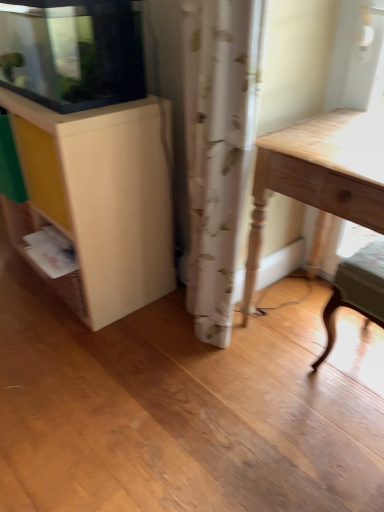
Question: Is matte white cabinet at upper left, which is the second cabinetry from bottom to top, inside matte white cabinet at left, which ranks as the first cabinetry in bottom-to-top order?

Choices:
 (A) yes
 (B) no

Answer: (B)

Question: From the image's perspective, would you say matte white cabinet at left, which appears as the 2th cabinetry when viewed from the top, is shown under matte white cabinet at upper left, which is the second cabinetry from bottom to top?

Choices:
 (A) yes
 (B) no

Answer: (A)

Question: Is matte white cabinet at left, which ranks as the first cabinetry in bottom-to-top order, at the right side of matte white cabinet at upper left, which is the second cabinetry from bottom to top?

Choices:
 (A) yes
 (B) no

Answer: (B)

Question: Is matte white cabinet at left, which ranks as the first cabinetry in bottom-to-top order, to the left of matte white cabinet at upper left, which is the second cabinetry from bottom to top, from the viewer's perspective?

Choices:
 (A) yes
 (B) no

Answer: (A)

Question: Does matte white cabinet at left, which ranks as the first cabinetry in bottom-to-top order, have a smaller size compared to matte white cabinet at upper left, placed as the 1th cabinetry when sorted from top to bottom?

Choices:
 (A) no
 (B) yes

Answer: (A)

Question: Could you tell me if matte white cabinet at left, which ranks as the first cabinetry in bottom-to-top order, is facing matte white cabinet at upper left, placed as the 1th cabinetry when sorted from top to bottom?

Choices:
 (A) yes
 (B) no

Answer: (B)

Question: Considering the relative positions of wooden chair at lower right and matte white cabinet at left, which appears as the 2th cabinetry when viewed from the top, in the image provided, is wooden chair at lower right to the right of matte white cabinet at left, which appears as the 2th cabinetry when viewed from the top, from the viewer's perspective?

Choices:
 (A) no
 (B) yes

Answer: (B)

Question: Is wooden chair at lower right far away from matte white cabinet at left, which appears as the 2th cabinetry when viewed from the top?

Choices:
 (A) no
 (B) yes

Answer: (A)

Question: Can matte white cabinet at left, which appears as the 2th cabinetry when viewed from the top, be found inside wooden chair at lower right?

Choices:
 (A) yes
 (B) no

Answer: (B)

Question: Does wooden chair at lower right have a smaller size compared to matte white cabinet at left, which appears as the 2th cabinetry when viewed from the top?

Choices:
 (A) no
 (B) yes

Answer: (B)

Question: Does wooden chair at lower right come behind matte white cabinet at left, which appears as the 2th cabinetry when viewed from the top?

Choices:
 (A) no
 (B) yes

Answer: (A)

Question: Considering the relative sizes of wooden chair at lower right and matte white cabinet at left, which ranks as the first cabinetry in bottom-to-top order, in the image provided, is wooden chair at lower right wider than matte white cabinet at left, which ranks as the first cabinetry in bottom-to-top order,?

Choices:
 (A) no
 (B) yes

Answer: (A)

Question: Is wooden chair at lower right to the right of light wood table at right from the viewer's perspective?

Choices:
 (A) no
 (B) yes

Answer: (B)